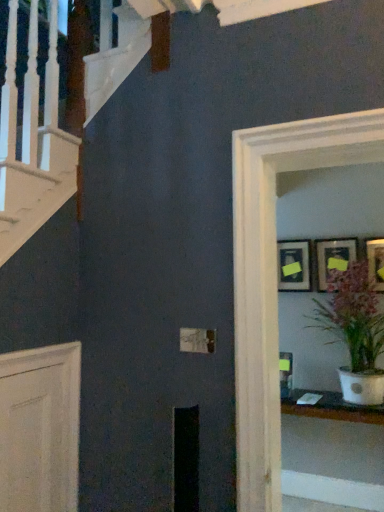
Where is `white glossy pot at center-right`? Image resolution: width=384 pixels, height=512 pixels. white glossy pot at center-right is located at coordinates (355, 332).

In order to face matte black picture frame at upper right, the second picture frame viewed from the left, should I rotate leftwards or rightwards?

To align with it, rotate right about 18.623°.

Measure the distance between matte black picture frame at upper right, which is the first picture frame from left to right, and camera.

10.44 feet.

What do you see at coordinates (376, 262) in the screenshot?
I see `matte black picture frame at upper right, the 3th picture frame when ordered from left to right` at bounding box center [376, 262].

What is the approximate height of white glossy glass door at upper right?

1.49 meters.

This screenshot has height=512, width=384. Find the location of `white glossy pot at center-right`. white glossy pot at center-right is located at coordinates coord(355,332).

Is matte black picture frame at upper right, which appears as the 2th picture frame when viewed from the right, oriented towards matte black picture frame at upper right, acting as the 3th picture frame starting from the right?

No, matte black picture frame at upper right, which appears as the 2th picture frame when viewed from the right, is not oriented towards matte black picture frame at upper right, acting as the 3th picture frame starting from the right.

Is matte black picture frame at upper right, the second picture frame viewed from the left, surrounding matte black picture frame at upper right, which is the first picture frame from left to right?

No, matte black picture frame at upper right, which is the first picture frame from left to right, is not surrounded by matte black picture frame at upper right, the second picture frame viewed from the left.

Considering the relative positions of matte black picture frame at upper right, the second picture frame viewed from the left, and matte black picture frame at upper right, which is the first picture frame from left to right, in the image provided, is matte black picture frame at upper right, the second picture frame viewed from the left, to the left of matte black picture frame at upper right, which is the first picture frame from left to right, from the viewer's perspective?

Incorrect, matte black picture frame at upper right, the second picture frame viewed from the left, is not on the left side of matte black picture frame at upper right, which is the first picture frame from left to right.

Is matte black picture frame at upper right, the second picture frame viewed from the left, in contact with matte black picture frame at upper right, which is the first picture frame from left to right?

matte black picture frame at upper right, the second picture frame viewed from the left, and matte black picture frame at upper right, which is the first picture frame from left to right, are clearly separated.

From a real-world perspective, is matte black picture frame at upper right, which is the first picture frame from left to right, below white glossy glass door at upper right?

Incorrect, from a real-world perspective, matte black picture frame at upper right, which is the first picture frame from left to right, is higher than white glossy glass door at upper right.

Who is smaller, matte black picture frame at upper right, acting as the 3th picture frame starting from the right, or white glossy glass door at upper right?

With smaller size is matte black picture frame at upper right, acting as the 3th picture frame starting from the right.

Between matte black picture frame at upper right, which is the first picture frame from left to right, and white glossy glass door at upper right, which one has larger width?

white glossy glass door at upper right is wider.

Is white glossy glass door at upper right completely or partially inside matte black picture frame at upper right, which is the first picture frame from left to right?

Definitely not — white glossy glass door at upper right is not inside matte black picture frame at upper right, which is the first picture frame from left to right.

Considering the relative sizes of matte black picture frame at upper right, the 3th picture frame when ordered from left to right, and white glossy table at lower right in the image provided, is matte black picture frame at upper right, the 3th picture frame when ordered from left to right, bigger than white glossy table at lower right?

Actually, matte black picture frame at upper right, the 3th picture frame when ordered from left to right, might be smaller than white glossy table at lower right.

Considering the sizes of objects matte black picture frame at upper right, the 3th picture frame when ordered from left to right, and white glossy table at lower right in the image provided, who is taller, matte black picture frame at upper right, the 3th picture frame when ordered from left to right, or white glossy table at lower right?

white glossy table at lower right is taller.

This screenshot has width=384, height=512. In order to click on table on the left of matte black picture frame at upper right, the 3th picture frame when ordered from left to right in this screenshot , I will do `click(332, 456)`.

Which is correct: matte black picture frame at upper right, the 3th picture frame when ordered from left to right, is inside white glossy table at lower right, or outside of it?

matte black picture frame at upper right, the 3th picture frame when ordered from left to right, cannot be found inside white glossy table at lower right.

Between matte black picture frame at upper right, acting as the 3th picture frame starting from the right, and white glossy pot at center-right, which one is positioned in front?

white glossy pot at center-right is more forward.

What are the coordinates of `the 3rd picture frame behind the white glossy pot at center-right` in the screenshot? It's located at (293, 265).

Does matte black picture frame at upper right, which is the first picture frame from left to right, have a larger size compared to white glossy pot at center-right?

No, matte black picture frame at upper right, which is the first picture frame from left to right, is not bigger than white glossy pot at center-right.

From the picture: Is matte black picture frame at upper right, acting as the 3th picture frame starting from the right, oriented away from white glossy pot at center-right?

No, matte black picture frame at upper right, acting as the 3th picture frame starting from the right, is not facing away from white glossy pot at center-right.

Starting from the white glossy table at lower right, which picture frame is the 1st one behind? Please provide its 2D coordinates.

[(376, 262)]

From the image's perspective, is white glossy table at lower right positioned above or below matte black picture frame at upper right, the 3th picture frame when ordered from left to right?

white glossy table at lower right is situated lower than matte black picture frame at upper right, the 3th picture frame when ordered from left to right, in the image.

Is white glossy table at lower right not near matte black picture frame at upper right, the 1th picture frame viewed from the right?

That's right, there is a large distance between white glossy table at lower right and matte black picture frame at upper right, the 1th picture frame viewed from the right.

Does white glossy table at lower right turn towards matte black picture frame at upper right, the 1th picture frame viewed from the right?

No.

From a real-world perspective, does white glossy glass door at upper right sit lower than matte black picture frame at upper right, the 3th picture frame when ordered from left to right?

Yes, from a real-world perspective, white glossy glass door at upper right is beneath matte black picture frame at upper right, the 3th picture frame when ordered from left to right.

Measure the distance from white glossy glass door at upper right to matte black picture frame at upper right, the 1th picture frame viewed from the right.

A distance of 5.00 feet exists between white glossy glass door at upper right and matte black picture frame at upper right, the 1th picture frame viewed from the right.

Is white glossy glass door at upper right located outside matte black picture frame at upper right, the 3th picture frame when ordered from left to right?

Yes, white glossy glass door at upper right is located beyond the bounds of matte black picture frame at upper right, the 3th picture frame when ordered from left to right.

From the image's perspective, between white glossy glass door at upper right and matte black picture frame at upper right, the 1th picture frame viewed from the right, which one is located above?

matte black picture frame at upper right, the 1th picture frame viewed from the right, appears higher in the image.

From a real-world perspective, is white glossy table at lower right physically located above or below white glossy pot at center-right?

white glossy table at lower right is below white glossy pot at center-right.

Could you tell me if white glossy table at lower right is turned towards white glossy pot at center-right?

No, white glossy table at lower right is not turned towards white glossy pot at center-right.

Is white glossy table at lower right at the left side of white glossy pot at center-right?

Indeed, white glossy table at lower right is positioned on the left side of white glossy pot at center-right.

Is white glossy table at lower right located outside white glossy pot at center-right?

white glossy table at lower right lies outside white glossy pot at center-right's area.

At what (x,y) coordinates should I click in order to perform the action: click on the 1st picture frame in front of the matte black picture frame at upper right, which is the first picture frame from left to right. Please return your answer as a coordinate pair (x, y). The image size is (384, 512). Looking at the image, I should click on (333, 258).

This screenshot has width=384, height=512. Identify the location of picture frame that is the 1st object above the white glossy glass door at upper right (from a real-world perspective). (293, 265).

In the scene shown: From the image, which object appears to be nearer to matte black picture frame at upper right, which appears as the 2th picture frame when viewed from the right, matte black picture frame at upper right, which is the first picture frame from left to right, or white glossy glass door at upper right?

matte black picture frame at upper right, which is the first picture frame from left to right.

Considering their positions, is matte black picture frame at upper right, acting as the 3th picture frame starting from the right, positioned further to matte black picture frame at upper right, the 3th picture frame when ordered from left to right, than white glossy glass door at upper right?

white glossy glass door at upper right lies further to matte black picture frame at upper right, the 3th picture frame when ordered from left to right, than the other object.

From the picture: From the image, which object appears to be farther from white glossy glass door at upper right, matte black picture frame at upper right, which is the first picture frame from left to right, or white glossy table at lower right?

The object further to white glossy glass door at upper right is white glossy table at lower right.

Based on their spatial positions, is matte black picture frame at upper right, which is the first picture frame from left to right, or white glossy table at lower right further from matte black picture frame at upper right, which appears as the 2th picture frame when viewed from the right?

white glossy table at lower right is positioned further to the anchor matte black picture frame at upper right, which appears as the 2th picture frame when viewed from the right.

Which object lies nearer to the anchor point white glossy table at lower right, matte black picture frame at upper right, the second picture frame viewed from the left, or white glossy pot at center-right?

white glossy pot at center-right lies closer to white glossy table at lower right than the other object.

Looking at the image, which one is located closer to matte black picture frame at upper right, which appears as the 2th picture frame when viewed from the right, white glossy table at lower right or white glossy glass door at upper right?

white glossy table at lower right.

Considering their positions, is white glossy glass door at upper right positioned closer to matte black picture frame at upper right, which is the first picture frame from left to right, than white glossy pot at center-right?

Based on the image, white glossy pot at center-right appears to be nearer to matte black picture frame at upper right, which is the first picture frame from left to right.

In the scene shown: Estimate the real-world distances between objects in this image. Which object is further from white glossy pot at center-right, matte black picture frame at upper right, which is the first picture frame from left to right, or matte black picture frame at upper right, the second picture frame viewed from the left?

matte black picture frame at upper right, which is the first picture frame from left to right, is further to white glossy pot at center-right.

The height and width of the screenshot is (512, 384). Find the location of `picture frame between matte black picture frame at upper right, which appears as the 2th picture frame when viewed from the right, and white glossy table at lower right vertically`. picture frame between matte black picture frame at upper right, which appears as the 2th picture frame when viewed from the right, and white glossy table at lower right vertically is located at coordinates (293, 265).

In order to click on table between white glossy glass door at upper right and matte black picture frame at upper right, which appears as the 2th picture frame when viewed from the right, from front to back in this screenshot , I will do `click(332, 456)`.

Where is `houseplant positioned between white glossy glass door at upper right and matte black picture frame at upper right, acting as the 3th picture frame starting from the right, from near to far`? houseplant positioned between white glossy glass door at upper right and matte black picture frame at upper right, acting as the 3th picture frame starting from the right, from near to far is located at coordinates (355, 332).

What are the coordinates of `houseplant between white glossy glass door at upper right and matte black picture frame at upper right, the second picture frame viewed from the left, from front to back` in the screenshot? It's located at (355, 332).